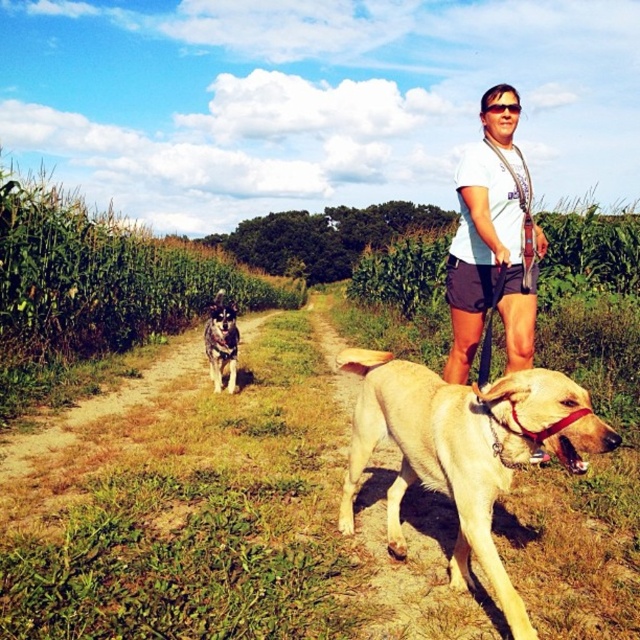
Question: Among these points, which one is farthest from the camera?

Choices:
 (A) (211, 368)
 (B) (492, 120)
 (C) (410, 420)

Answer: (A)

Question: Considering the real-world distances, which object is closest to the white t-shirt at center?

Choices:
 (A) golden fur dog at center
 (B) gray fur dog at left

Answer: (A)

Question: Which point is closer to the camera?

Choices:
 (A) (481, 525)
 (B) (212, 342)

Answer: (A)

Question: Does golden fur dog at center come in front of gray fur dog at left?

Choices:
 (A) no
 (B) yes

Answer: (B)

Question: Is golden fur dog at center closer to the viewer compared to gray fur dog at left?

Choices:
 (A) yes
 (B) no

Answer: (A)

Question: Is white t-shirt at center further to camera compared to gray fur dog at left?

Choices:
 (A) no
 (B) yes

Answer: (A)